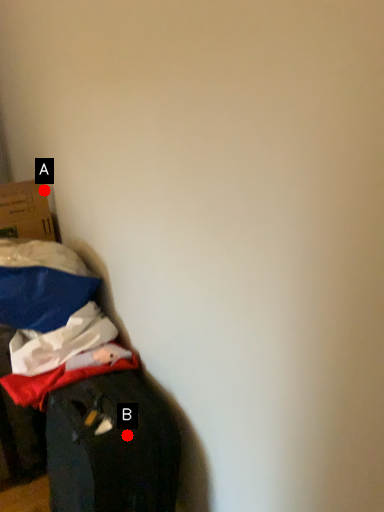
Question: Two points are circled on the image, labeled by A and B beside each circle. Among these points, which one is farthest from the camera?

Choices:
 (A) A is further
 (B) B is further

Answer: (A)